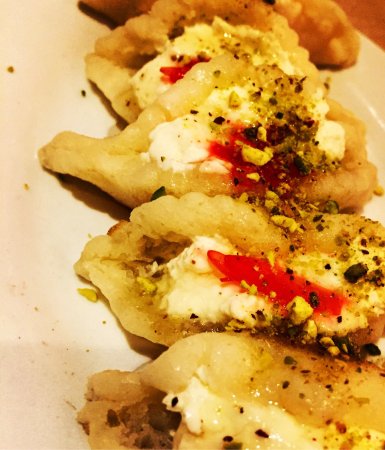
This screenshot has height=450, width=385. What are the coordinates of `plate` in the screenshot? It's located at (113, 352).